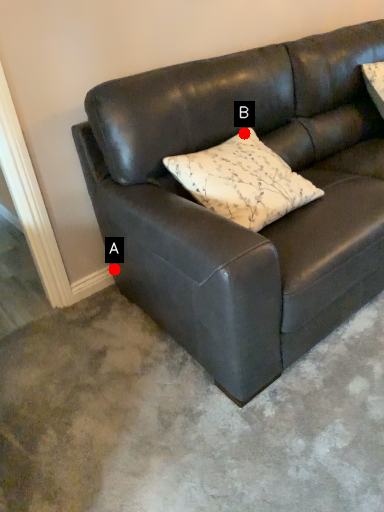
Question: Two points are circled on the image, labeled by A and B beside each circle. Which point appears farthest from the camera in this image?

Choices:
 (A) A is further
 (B) B is further

Answer: (A)